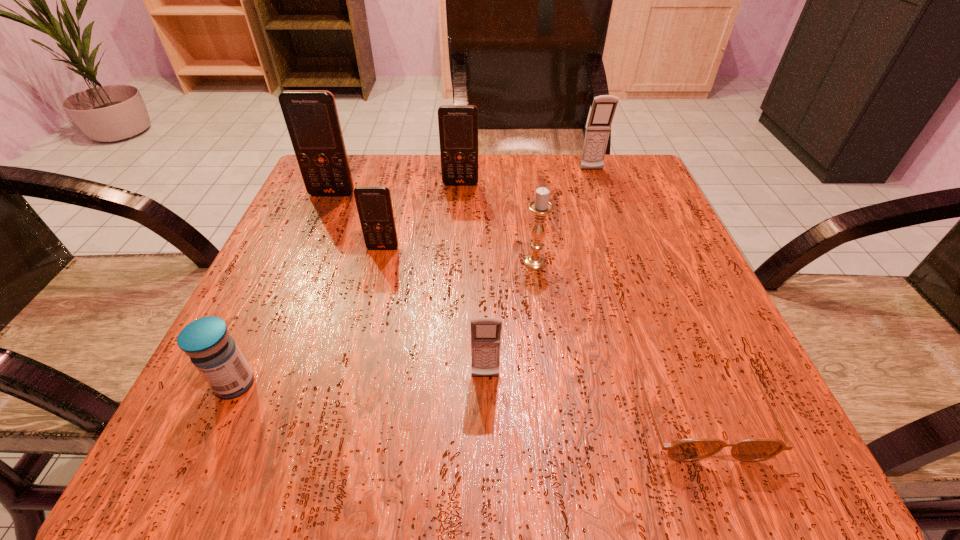
You are a GUI agent. You are given a task and a screenshot of the screen. Output one action in this format:
    pyautogui.click(x=<x>, y=<y>)
    Task: Click on the object located at the near right corner
    
    Given the screenshot: What is the action you would take?
    pyautogui.click(x=757, y=449)

You are a GUI agent. You are given a task and a screenshot of the screen. Output one action in this format:
    pyautogui.click(x=<x>, y=<y>)
    Task: Click on the vacant point at the far edge
    
    Given the screenshot: What is the action you would take?
    (504, 167)

At what (x,y) coordinates should I click in order to perform the action: click on blank area at the near edge. Please return your answer as a coordinate pair (x, y). This screenshot has width=960, height=540. Looking at the image, I should click on (506, 408).

In order to click on vacant space at the left edge of the desktop in this screenshot , I will do `click(349, 240)`.

Find the location of a particular element. vacant space at the right edge of the desktop is located at coordinates 718,320.

Identify the location of vacant space at the far left corner of the desktop. (373, 161).

Identify the location of vacant space at the far right corner. (577, 169).

In order to click on free space between the brown sunglasses and the sixth nearest object in this screenshot , I will do `click(514, 299)`.

The height and width of the screenshot is (540, 960). I want to click on vacant space that is in between the second farthest orange cellular telephone and the nearer gray cellular telephone, so click(409, 285).

The image size is (960, 540). What are the coordinates of `unoccupied position between the medicine and the farthest cellular telephone` in the screenshot? It's located at (414, 277).